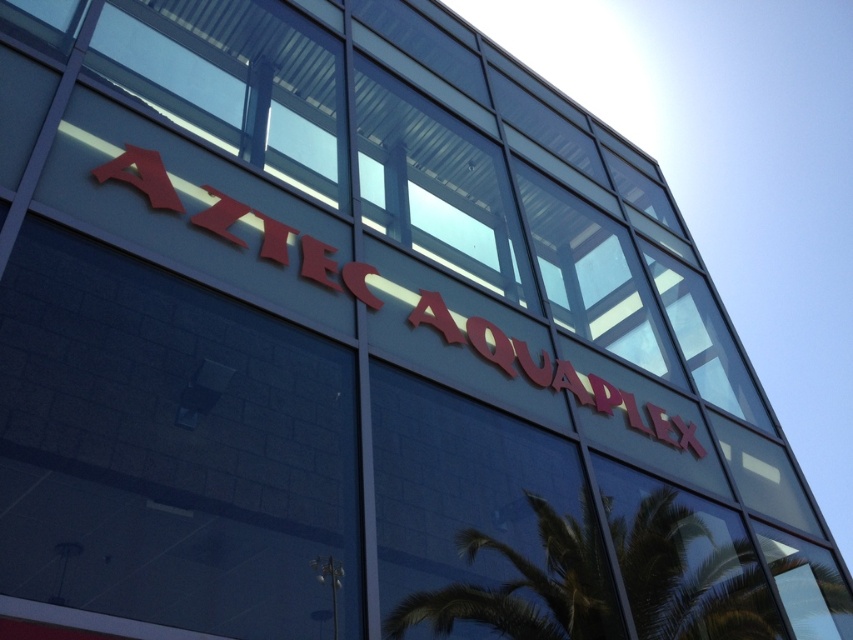
How much distance is there between green leafy palm tree at lower right and red glossy sign at upper center?

A distance of 4.00 feet exists between green leafy palm tree at lower right and red glossy sign at upper center.

Between point (585, 616) and point (376, 294), which one is positioned behind?

Positioned behind is point (376, 294).

Identify the location of green leafy palm tree at lower right. (688, 568).